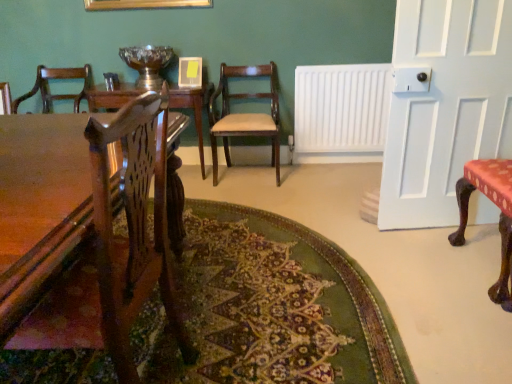
At what (x,y) coordinates should I click in order to perform the action: click on unoccupied area in front of mahogany wood chair at center, which appears as the 2th chair when viewed from the right. Please return your answer as a coordinate pair (x, y). This screenshot has height=384, width=512. Looking at the image, I should click on (243, 192).